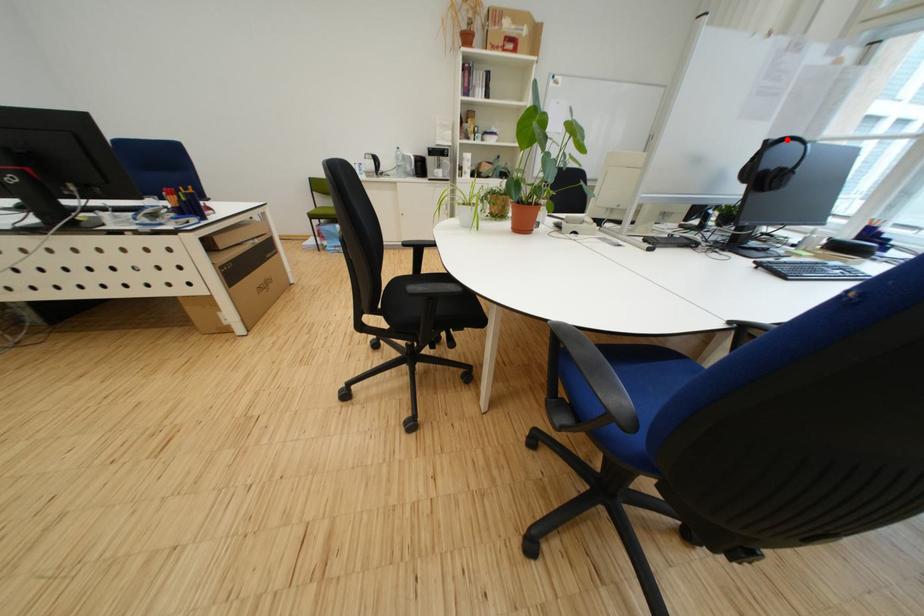
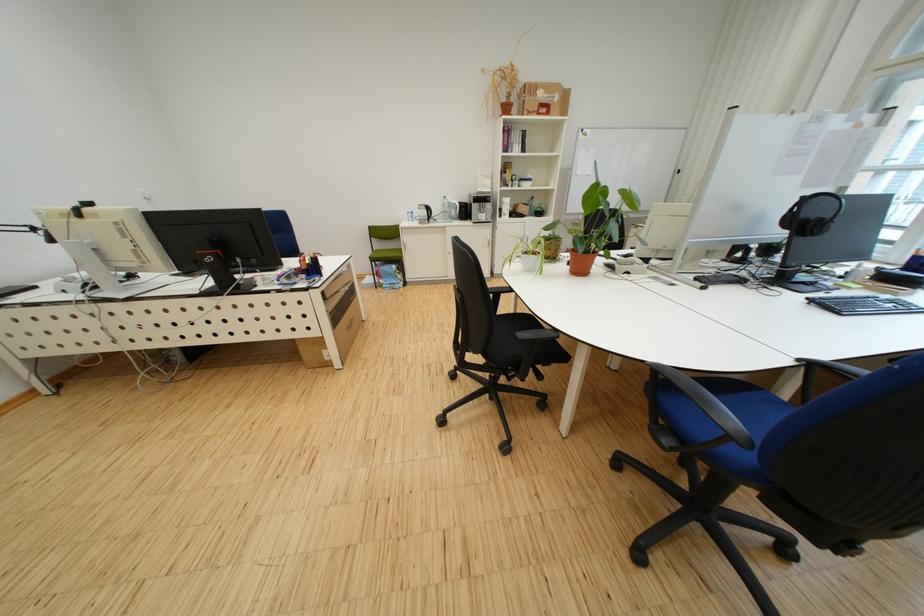
Question: I am providing you with two images of the same scene from different viewpoints. A red point is marked on the first image. At the location where the point appears in image 1, is it still visible in image 2?

Choices:
 (A) Yes
 (B) No

Answer: (A)